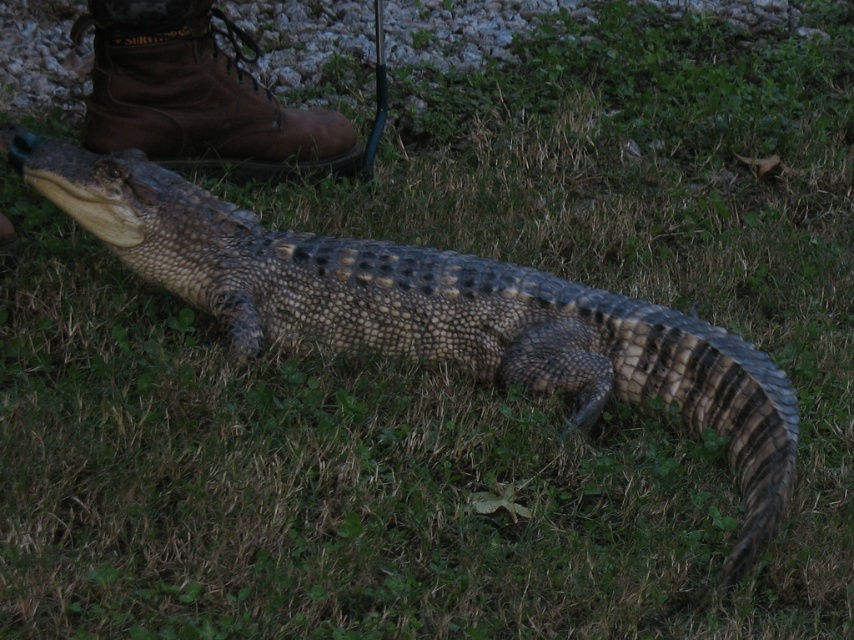
Looking at this image, can you confirm if scaly brown crocodile at center is bigger than brown leather boot at upper left?

Yes, scaly brown crocodile at center is bigger than brown leather boot at upper left.

Which is above, scaly brown crocodile at center or brown leather boot at upper left?

brown leather boot at upper left is higher up.

Who is more distant from viewer, (531, 282) or (167, 4)?

Point (167, 4)

Find the location of `scaly brown crocodile at center`. scaly brown crocodile at center is located at coordinates (430, 312).